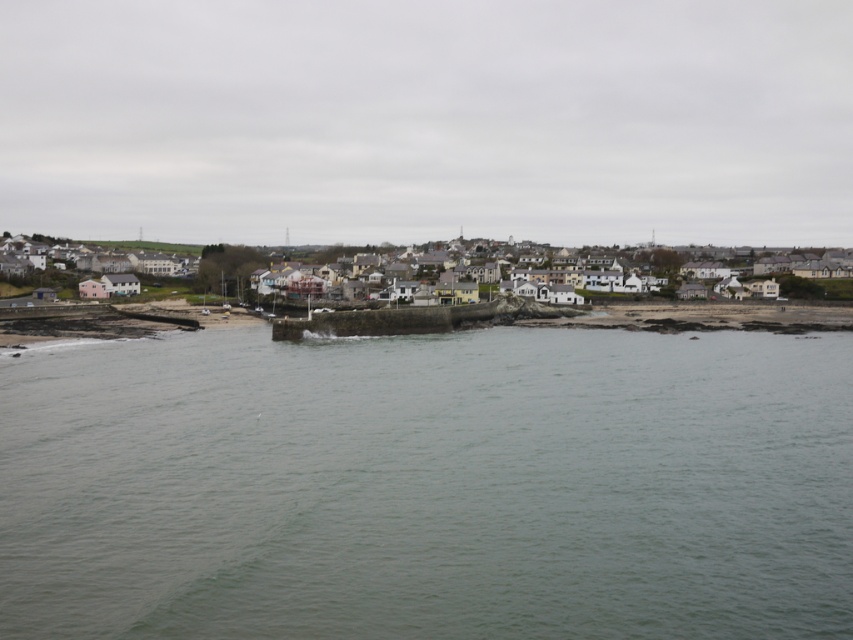
Who is positioned more to the right, greenish-gray water at center or white matte houses at center?

From the viewer's perspective, greenish-gray water at center appears more on the right side.

At what (x,y) coordinates should I click in order to perform the action: click on greenish-gray water at center. Please return your answer as a coordinate pair (x, y). This screenshot has height=640, width=853. Looking at the image, I should click on (428, 484).

The width and height of the screenshot is (853, 640). I want to click on greenish-gray water at center, so click(x=428, y=484).